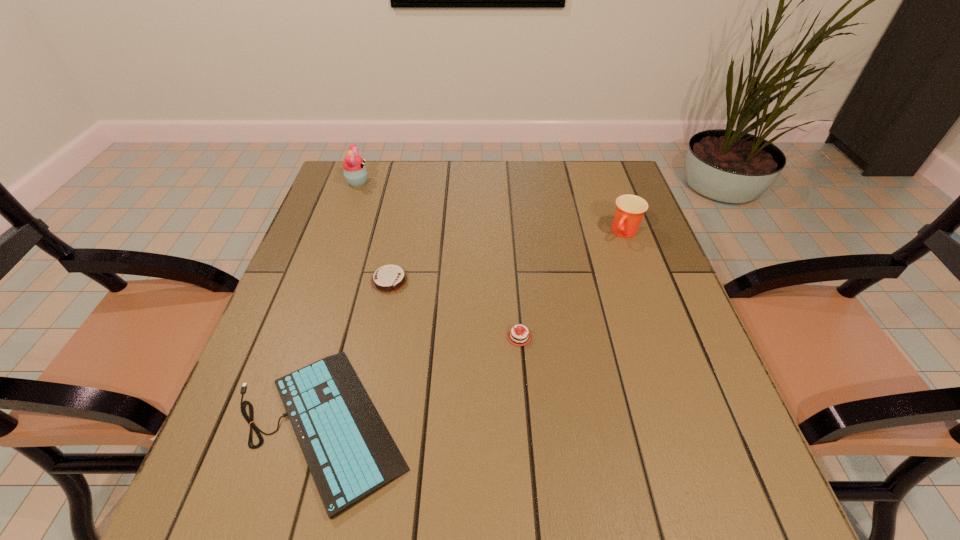
Where is `blank region between the rightmost object and the nearer chocolate cake`? This screenshot has height=540, width=960. blank region between the rightmost object and the nearer chocolate cake is located at coordinates (572, 285).

Identify the location of vacant point located between the fourth nearest object and the tallest object. (492, 207).

Where is `unoccupied area between the cupcake and the rightmost object`? unoccupied area between the cupcake and the rightmost object is located at coordinates (492, 207).

Identify the location of blank region between the tallest object and the farther chocolate cake. (373, 232).

The height and width of the screenshot is (540, 960). Identify the location of free space between the cupcake and the computer keyboard. (339, 303).

The image size is (960, 540). What are the coordinates of `free space that is in between the farther chocolate cake and the nearer chocolate cake` in the screenshot? It's located at (454, 309).

This screenshot has width=960, height=540. What are the coordinates of `object that stands as the third closest to the left chocolate cake` in the screenshot? It's located at (355, 172).

Identify which object is the second nearest to the computer keyboard. Please provide its 2D coordinates. Your answer should be formatted as a tuple, i.e. [(x, y)], where the tuple contains the x and y coordinates of a point satisfying the conditions above.

[(388, 279)]

Locate an element on the screen. This screenshot has height=540, width=960. vacant space that satisfies the following two spatial constraints: 1. on the back side of the computer keyboard; 2. on the right side of the cup is located at coordinates (372, 233).

Locate an element on the screen. This screenshot has height=540, width=960. blank area in the image that satisfies the following two spatial constraints: 1. on the back side of the fourth shortest object; 2. on the right side of the third farthest object is located at coordinates (399, 233).